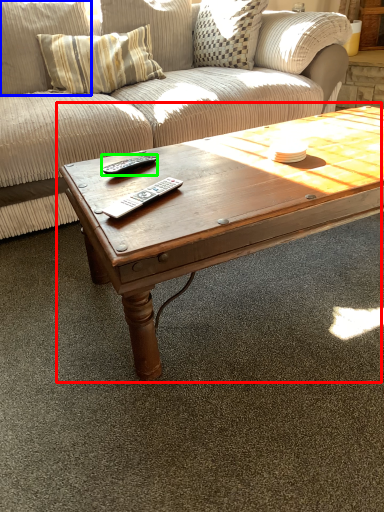
Question: Which object is positioned farthest from coffee table (highlighted by a red box)? Select from pillow (highlighted by a blue box) and remote (highlighted by a green box).

Choices:
 (A) pillow
 (B) remote

Answer: (A)